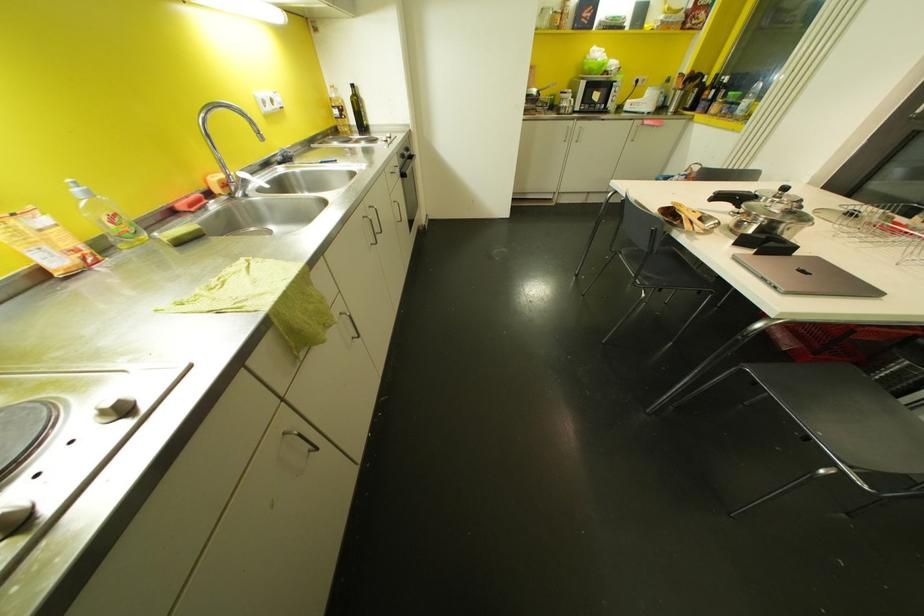
The image size is (924, 616). Describe the element at coordinates (795, 201) in the screenshot. I see `a pot lid handle` at that location.